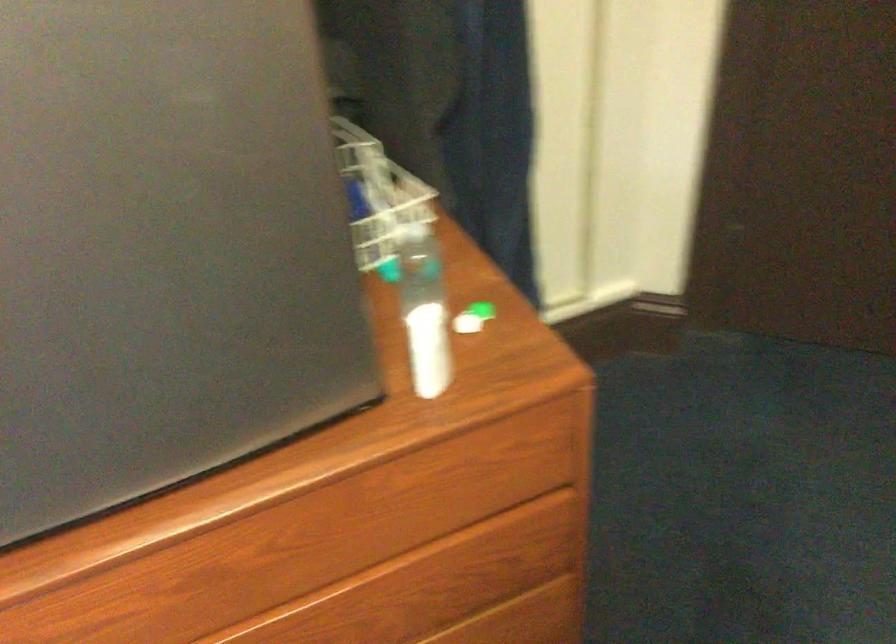
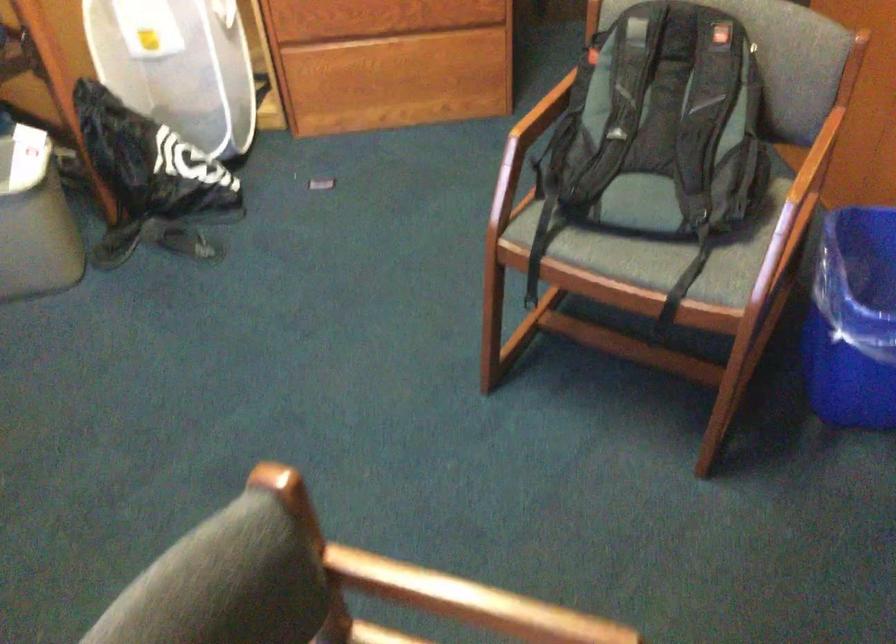
In a continuous first-person perspective shot, in which direction is the camera moving?

The cameraman moved toward right, backward.